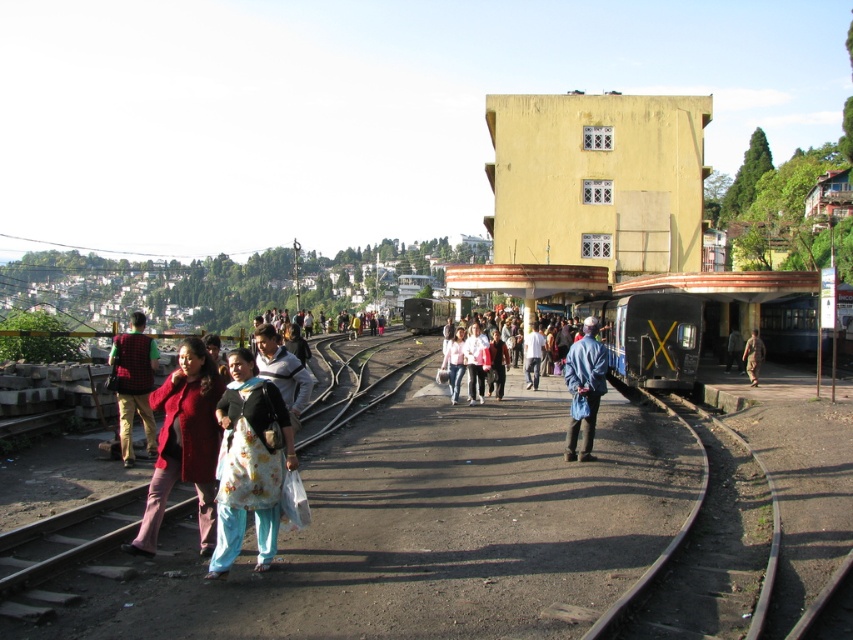
Question: Which object is farther from the camera taking this photo?

Choices:
 (A) light brown fabric jacket at center
 (B) light brown leather jacket at center

Answer: (A)

Question: Does camouflage fabric jacket at center have a greater width compared to light brown fabric jacket at center?

Choices:
 (A) no
 (B) yes

Answer: (B)

Question: Which object is positioned farthest from the matte red coat at center?

Choices:
 (A) light brown fabric jacket at center
 (B) light pink fabric at center

Answer: (A)

Question: Is matte red coat at center positioned in front of light brown leather jacket at center?

Choices:
 (A) yes
 (B) no

Answer: (A)

Question: Which point is closer to the camera?

Choices:
 (A) camouflage fabric jacket at center
 (B) floral fabric dress at center

Answer: (B)

Question: In this image, where is light pink fabric at center located relative to light brown fabric jacket at center?

Choices:
 (A) below
 (B) above

Answer: (B)